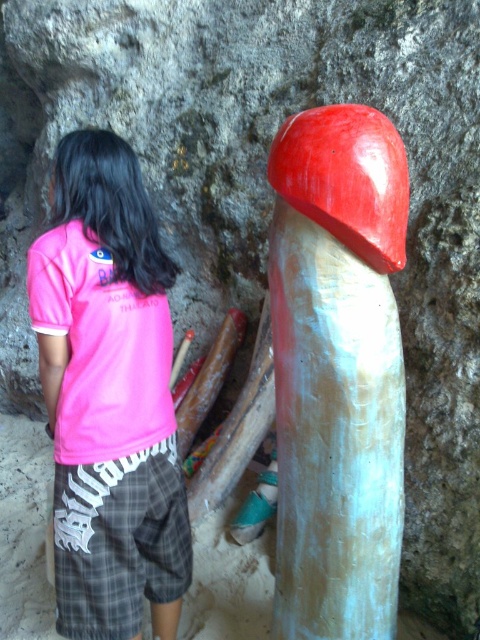
You are a photographer standing in front of the smooth white mushroom at center. You want to take a photo of it without getting too close. If your camera has a maximum zoom range of 1.5 meters, can you capture the entire mushroom in the frame without moving closer?

The distance between you and the smooth white mushroom at center is 1.41 meters, which is within the camera maximum zoom range of 1.5 meters. Therefore, you can capture the entire mushroom in the frame without moving closer.

You are a photographer trying to capture a detailed shot of the smooth white mushroom at center and the pink cotton shirt at center. Since you want to focus on the mushroom, which object should you move closer to the camera to ensure the mushroom fills the frame more?

The smooth white mushroom at center is narrower than the pink cotton shirt at center. To make the mushroom fill the frame more, move the smooth white mushroom at center closer to the camera.